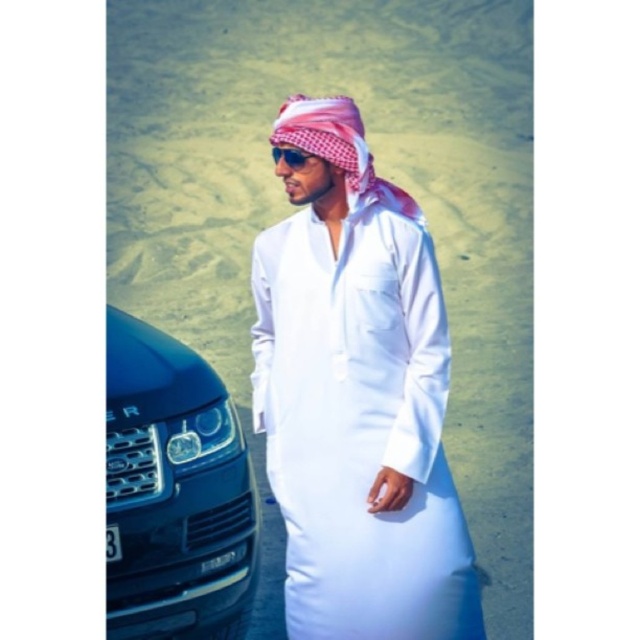
Is point (365, 312) behind point (275, 140)?

No.

Between point (300, 348) and point (296, 128), which one is positioned in front?

Point (296, 128) is more forward.

The image size is (640, 640). In order to click on white cotton thobe at center in this screenshot , I will do `click(356, 396)`.

Who is positioned more to the right, shiny blue car at left or sunglasses at center?

sunglasses at center is more to the right.

Does shiny blue car at left appear on the left side of sunglasses at center?

Yes, shiny blue car at left is to the left of sunglasses at center.

The image size is (640, 640). I want to click on shiny blue car at left, so click(173, 492).

Who is more distant from viewer, (355,314) or (280,147)?

The point (280,147) is more distant.

What are the coordinates of `white cotton thobe at center` in the screenshot? It's located at (356, 396).

Locate an element on the screen. white cotton thobe at center is located at coordinates (356, 396).

At what (x,y) coordinates should I click in order to perform the action: click on white cotton thobe at center. Please return your answer as a coordinate pair (x, y). Looking at the image, I should click on (356, 396).